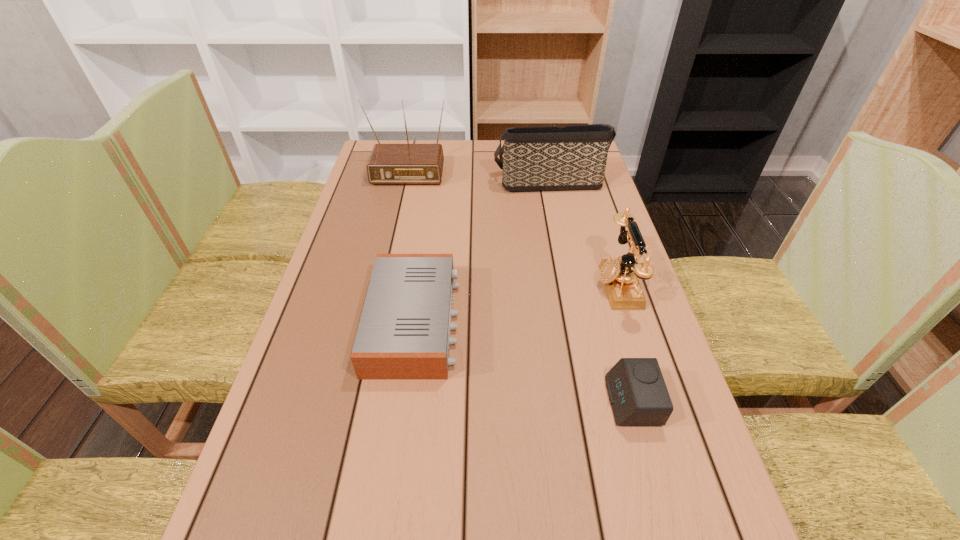
Where is `free location located 0.130m on the control panel of the shorter radio receiver`? The image size is (960, 540). free location located 0.130m on the control panel of the shorter radio receiver is located at coordinates (515, 322).

The width and height of the screenshot is (960, 540). In order to click on vacant space located on the front-facing side of the alarm clock in this screenshot , I will do `click(488, 401)`.

Locate an element on the screen. free spot located 0.250m on the front-facing side of the alarm clock is located at coordinates (482, 401).

What are the coordinates of `vacant space located on the front-facing side of the alarm clock` in the screenshot? It's located at (538, 401).

Identify the location of radio_receiver at the far edge. (407, 163).

Locate an element on the screen. The height and width of the screenshot is (540, 960). handbag at the far edge is located at coordinates tap(541, 158).

Locate an element on the screen. handbag that is positioned at the right edge is located at coordinates (541, 158).

Where is `telephone located in the right edge section of the desktop`? telephone located in the right edge section of the desktop is located at coordinates (621, 277).

I want to click on alarm clock that is at the right edge, so click(x=637, y=392).

I want to click on object that is positioned at the far left corner, so click(407, 163).